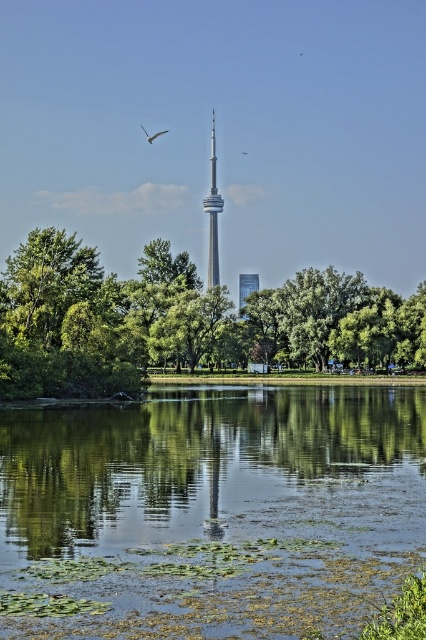
Is green algae-covered water at center to the left of white feathered bird at upper center from the viewer's perspective?

Yes, green algae-covered water at center is to the left of white feathered bird at upper center.

Which is more to the left, green algae-covered water at center or white feathered bird at upper center?

Positioned to the left is green algae-covered water at center.

Describe the element at coordinates (210, 513) in the screenshot. This screenshot has width=426, height=640. I see `green algae-covered water at center` at that location.

Where is `green algae-covered water at center`? The width and height of the screenshot is (426, 640). green algae-covered water at center is located at coordinates (210, 513).

Which is in front, point (259, 326) or point (213, 184)?

Point (259, 326) is in front.

Is green leafy tree at center wider than silver metallic tower at center?

Indeed, green leafy tree at center has a greater width compared to silver metallic tower at center.

Which is in front, point (164, 269) or point (215, 161)?

Point (164, 269) is more forward.

You are a GUI agent. You are given a task and a screenshot of the screen. Output one action in this format:
    pyautogui.click(x=<x>, y=<y>)
    Task: Click on the green leafy tree at center
    
    Given the screenshot: What is the action you would take?
    pyautogui.click(x=181, y=321)

Does green algae-covered water at center have a lesser height compared to white glossy bird at upper center?

Yes, green algae-covered water at center is shorter than white glossy bird at upper center.

Who is more forward, (403, 403) or (152, 138)?

Point (403, 403) is more forward.

Measure the distance between green algae-covered water at center and camera.

They are 15.66 meters apart.

What are the coordinates of `green algae-covered water at center` in the screenshot? It's located at (210, 513).